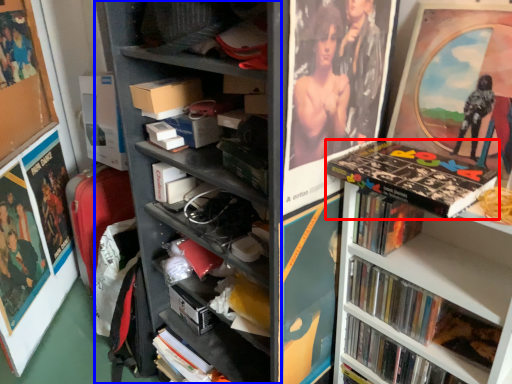
Question: Which object is further to the camera taking this photo, book (highlighted by a red box) or bookshelf (highlighted by a blue box)?

Choices:
 (A) book
 (B) bookshelf

Answer: (A)